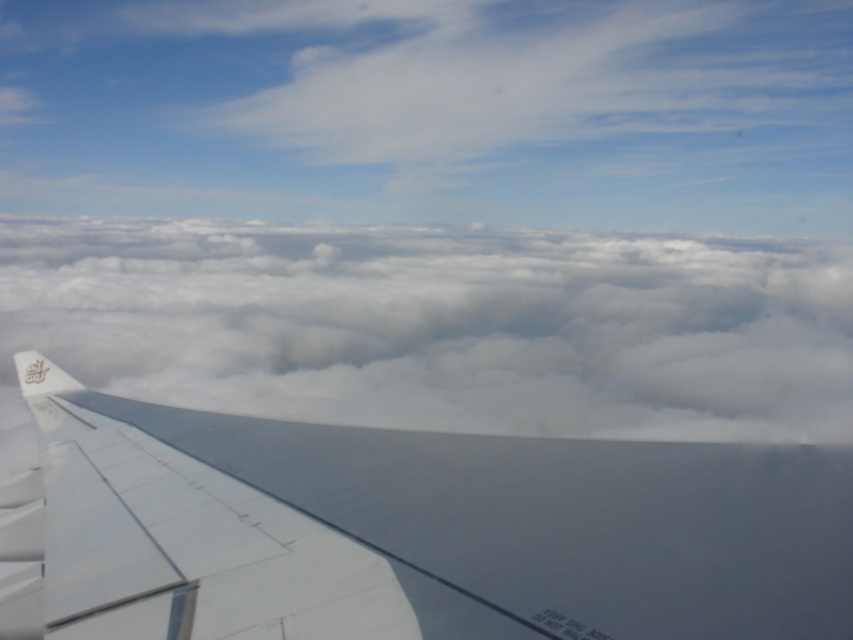
You are a flight attendant checking the wings for safety before takeoff. You notice the white matte wing at center and the white fluffy cloud at center in your line of sight. Which object is wider in your view?

The white fluffy cloud at center is wider than the white matte wing at center.

You are a passenger sitting in the airplane seat and looking out the window. You notice a specific point marked at coordinates (409,531). Based on the scene, can you determine what object or surface this point is located on?

The point at coordinates (409,531) is located on the white matte wing at center.